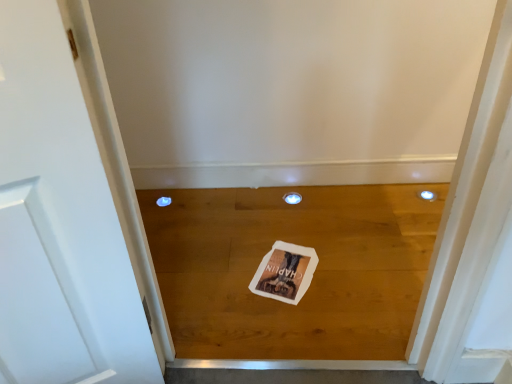
The height and width of the screenshot is (384, 512). I want to click on wooden floor at center, so click(x=313, y=277).

Image resolution: width=512 pixels, height=384 pixels. What do you see at coordinates (313, 277) in the screenshot? I see `wooden floor at center` at bounding box center [313, 277].

What do you see at coordinates (285, 272) in the screenshot? I see `white paper postcard at center` at bounding box center [285, 272].

What is the approximate height of white paper postcard at center?

white paper postcard at center is 0.61 inches in height.

The width and height of the screenshot is (512, 384). Identify the location of white paper postcard at center. (285, 272).

Identify the location of wooden floor at center. (313, 277).

Which is more to the right, wooden floor at center or white paper postcard at center?

Positioned to the right is wooden floor at center.

Is wooden floor at center in front of or behind white paper postcard at center in the image?

Clearly, wooden floor at center is in front of white paper postcard at center.

Is point (368, 315) in front of point (261, 263)?

Yes.

From the image's perspective, between wooden floor at center and white paper postcard at center, which one is located above?

From the image's view, wooden floor at center is above.

From a real-world perspective, which object rests below the other?

From a 3D spatial view, wooden floor at center is below.

Considering the sizes of wooden floor at center and white paper postcard at center in the image, is wooden floor at center wider or thinner than white paper postcard at center?

Considering their sizes, wooden floor at center looks broader than white paper postcard at center.

Considering the relative sizes of wooden floor at center and white paper postcard at center in the image provided, is wooden floor at center shorter than white paper postcard at center?

Incorrect, the height of wooden floor at center does not fall short of that of white paper postcard at center.

Based on their sizes in the image, would you say wooden floor at center is bigger or smaller than white paper postcard at center?

In the image, wooden floor at center appears to be larger than white paper postcard at center.

Is white paper postcard at center completely or partially inside wooden floor at center?

Yes, white paper postcard at center is surrounded by wooden floor at center.

Is wooden floor at center far from white paper postcard at center?

They are positioned close to each other.

Is wooden floor at center aimed at white paper postcard at center?

Yes, wooden floor at center faces towards white paper postcard at center.

The width and height of the screenshot is (512, 384). What are the coordinates of `plank below the white paper postcard at center (from a real-world perspective)` in the screenshot? It's located at (313, 277).

Between white paper postcard at center and wooden floor at center, which one appears on the left side from the viewer's perspective?

From the viewer's perspective, white paper postcard at center appears more on the left side.

Is white paper postcard at center further to the viewer compared to wooden floor at center?

Yes, white paper postcard at center is further from the viewer.

Does point (290, 297) appear closer or farther from the camera than point (336, 215)?

Clearly, point (290, 297) is closer to the camera than point (336, 215).

From the image's perspective, between white paper postcard at center and wooden floor at center, who is located below?

white paper postcard at center, from the image's perspective.

From a real-world perspective, who is located lower, white paper postcard at center or wooden floor at center?

In real-world perspective, wooden floor at center is lower.

Considering the sizes of white paper postcard at center and wooden floor at center in the image, is white paper postcard at center wider or thinner than wooden floor at center?

In the image, white paper postcard at center appears to be more narrow than wooden floor at center.

Is white paper postcard at center shorter than wooden floor at center?

Correct, white paper postcard at center is not as tall as wooden floor at center.

Considering the sizes of objects white paper postcard at center and wooden floor at center in the image provided, who is bigger, white paper postcard at center or wooden floor at center?

wooden floor at center is bigger.

Is wooden floor at center inside white paper postcard at center?

No, wooden floor at center is not a part of white paper postcard at center.

Are white paper postcard at center and wooden floor at center located far from each other?

No, there isn't a large distance between white paper postcard at center and wooden floor at center.

Is white paper postcard at center looking in the opposite direction of wooden floor at center?

Yes, wooden floor at center is at the back of white paper postcard at center.

Where is `plank lying on the right of white paper postcard at center`? plank lying on the right of white paper postcard at center is located at coordinates (313, 277).

Locate an element on the screen. The image size is (512, 384). plank in front of the white paper postcard at center is located at coordinates (313, 277).

Find the location of `postcard lying below the wooden floor at center (from the image's perspective)`. postcard lying below the wooden floor at center (from the image's perspective) is located at coordinates (285, 272).